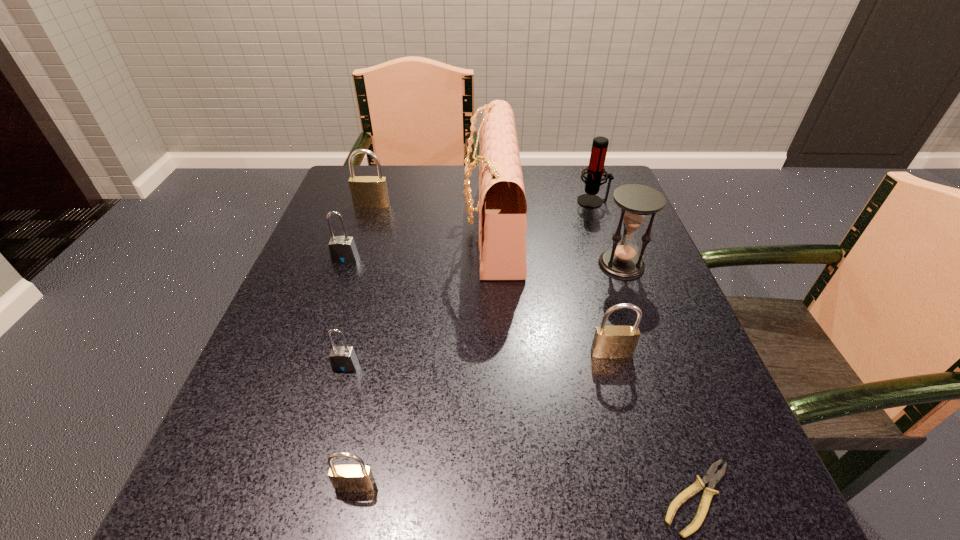
Identify the location of vacant area in the image that satisfies the following two spatial constraints: 1. on the front-facing side of the fifth object from left to right; 2. on the front-facing side of the nearest brass padlock. The height and width of the screenshot is (540, 960). (501, 486).

This screenshot has height=540, width=960. In order to click on vacant space that satisfies the following two spatial constraints: 1. on the front-facing side of the black hourglass; 2. on the right side of the handbag in this screenshot , I will do `click(493, 265)`.